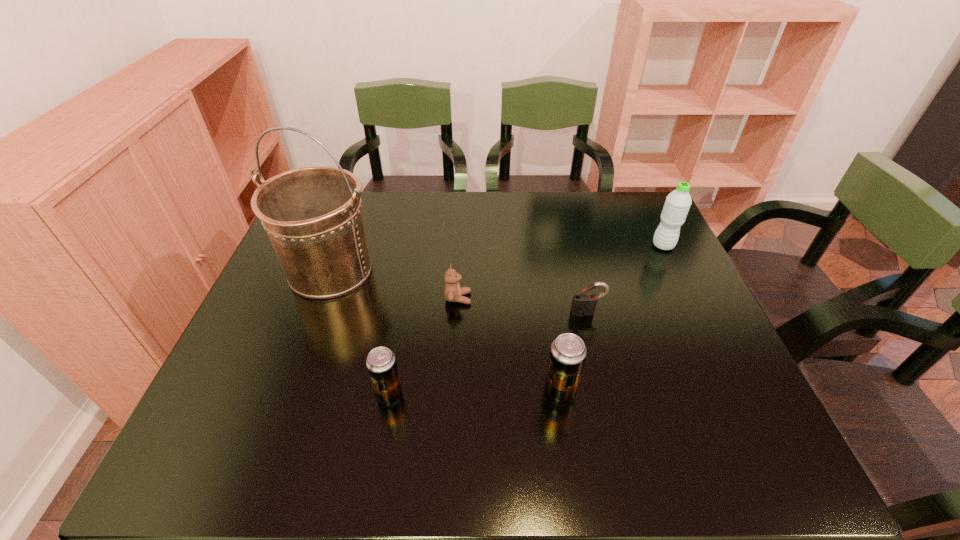
The width and height of the screenshot is (960, 540). Identify the location of vacant area that lies between the left beer can and the fifth shortest object. (526, 321).

Where is `vacant space that's between the third object from left to right and the padlock`? vacant space that's between the third object from left to right and the padlock is located at coordinates (522, 305).

The height and width of the screenshot is (540, 960). Identify the location of object that is the fifth closest to the third tallest object. (677, 204).

This screenshot has height=540, width=960. Identify the location of the third closest object relative to the fifth shortest object. (453, 292).

This screenshot has width=960, height=540. Find the location of `vacant space that satisfies the following two spatial constraints: 1. on the back side of the shorter beer can; 2. on the right side of the second tallest object`. vacant space that satisfies the following two spatial constraints: 1. on the back side of the shorter beer can; 2. on the right side of the second tallest object is located at coordinates (415, 246).

Identify the location of blank area in the image that satisfies the following two spatial constraints: 1. on the back side of the fourth object from left to right; 2. on the right side of the fifth shortest object. Image resolution: width=960 pixels, height=540 pixels. (538, 246).

I want to click on free space that satisfies the following two spatial constraints: 1. on the front side of the second object from left to right; 2. on the right side of the leftmost object, so click(x=284, y=396).